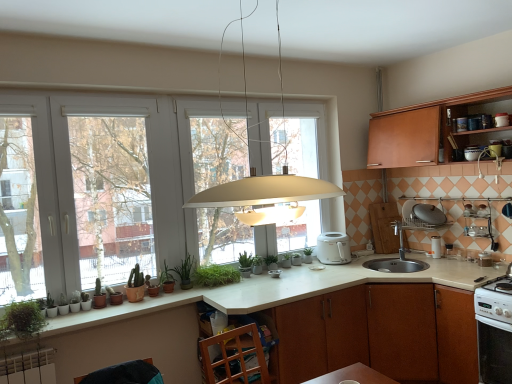
The image size is (512, 384). What are the coordinates of `vacant area located to the right-hand side of white plastic toaster at center, placed as the 3th appliance when sorted from front to back` in the screenshot? It's located at (292, 267).